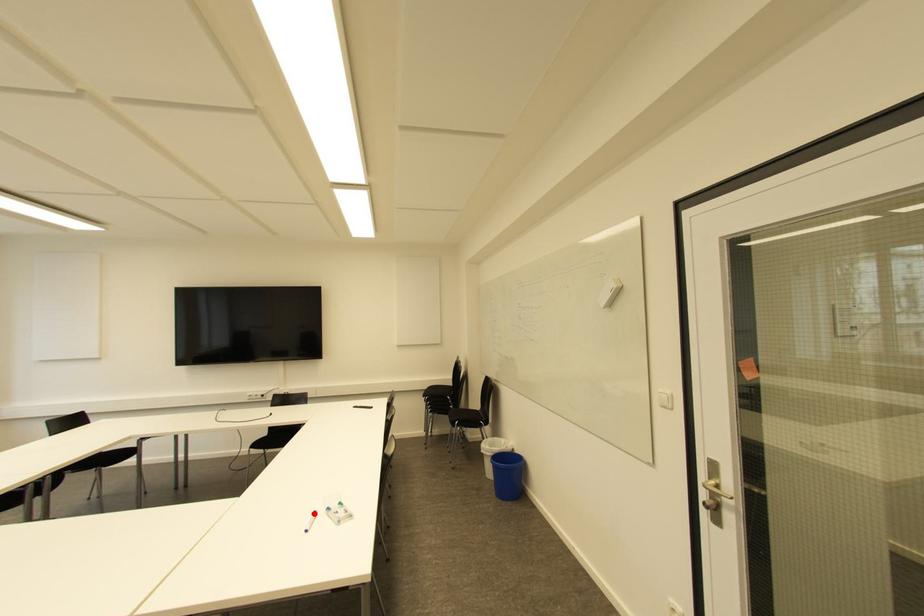
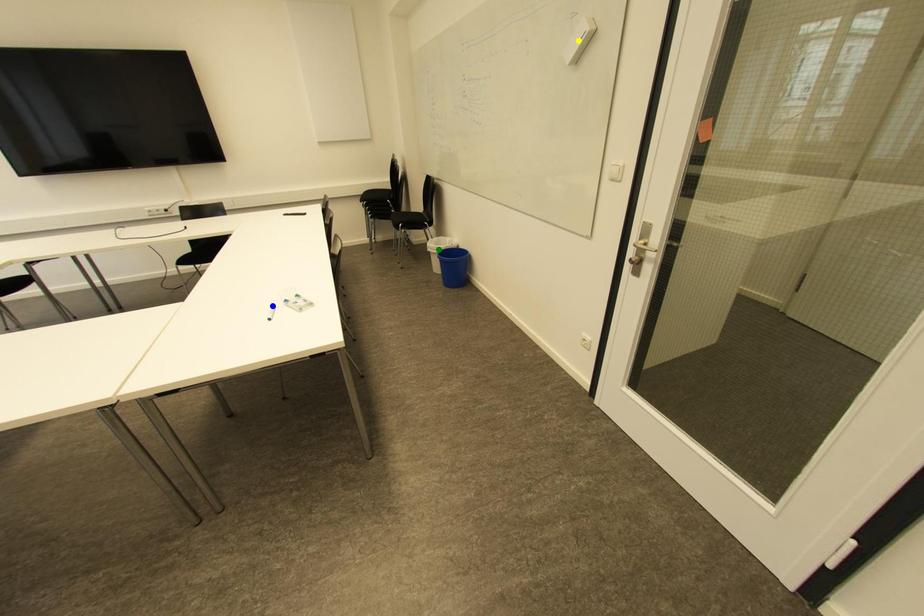
Question: I am providing you with two images of the same scene from different viewpoints. A red point is marked on the first image. You are given multiple points on the second image. In image 2, which mark is for the same physical point as the one in image 1?

Choices:
 (A) blue point
 (B) green point
 (C) yellow point

Answer: (A)